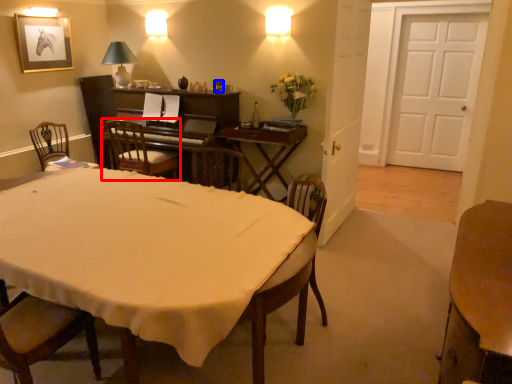
Question: Which point is closer to the camera, chair (highlighted by a red box) or wine glass (highlighted by a blue box)?

Choices:
 (A) chair
 (B) wine glass

Answer: (A)